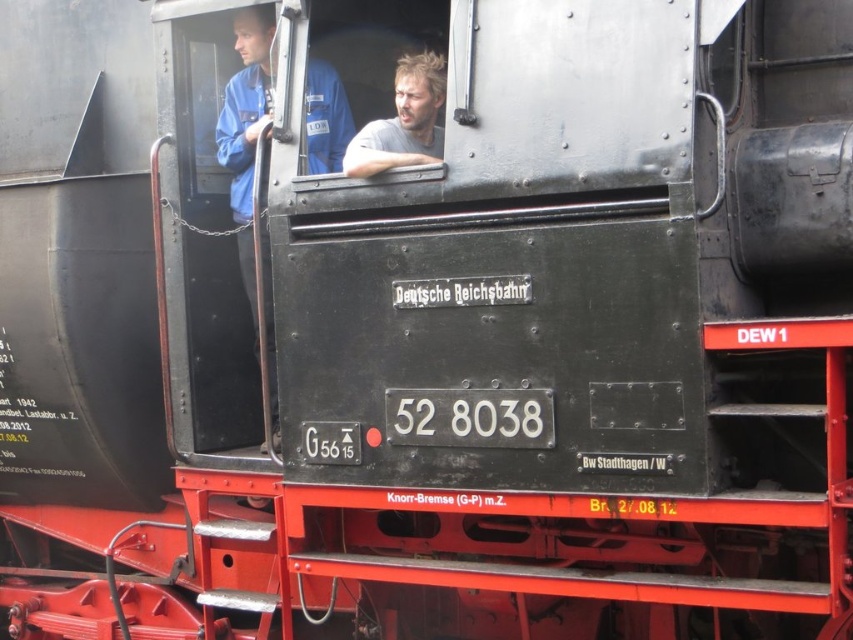
Is blue fabric shirt at left to the left of light brown hair at center from the viewer's perspective?

Correct, you'll find blue fabric shirt at left to the left of light brown hair at center.

Is blue fabric shirt at left positioned before light brown hair at center?

No, it is not.

The height and width of the screenshot is (640, 853). What do you see at coordinates (247, 131) in the screenshot? I see `blue fabric shirt at left` at bounding box center [247, 131].

Find the location of `blue fabric shirt at left`. blue fabric shirt at left is located at coordinates (247, 131).